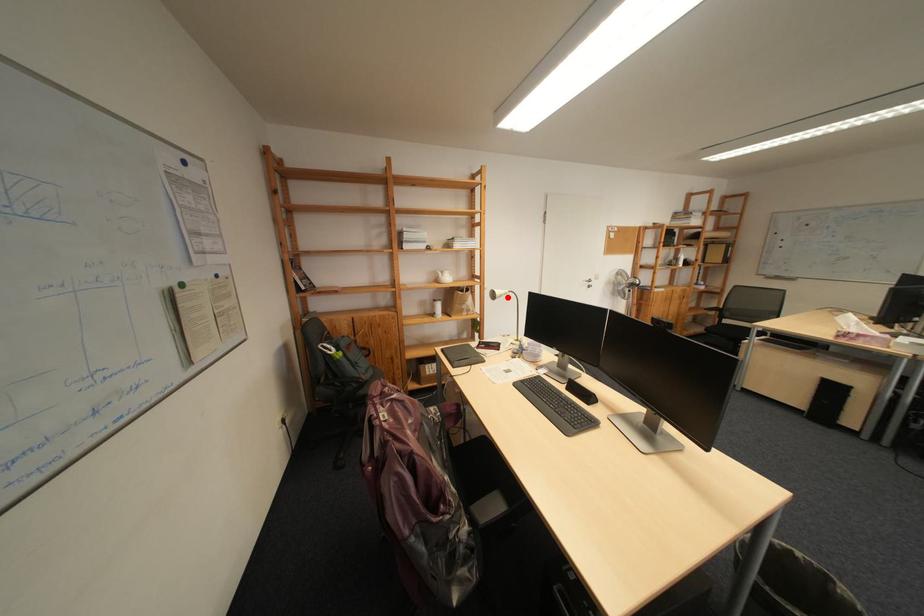
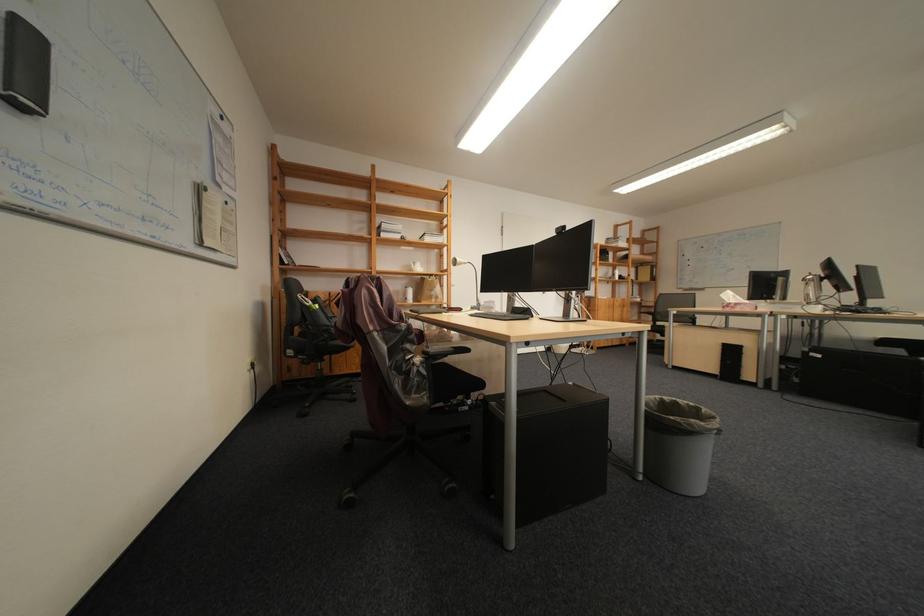
Locate, in the second image, the point that corresponds to the highlighted location in the first image.

(468, 264)